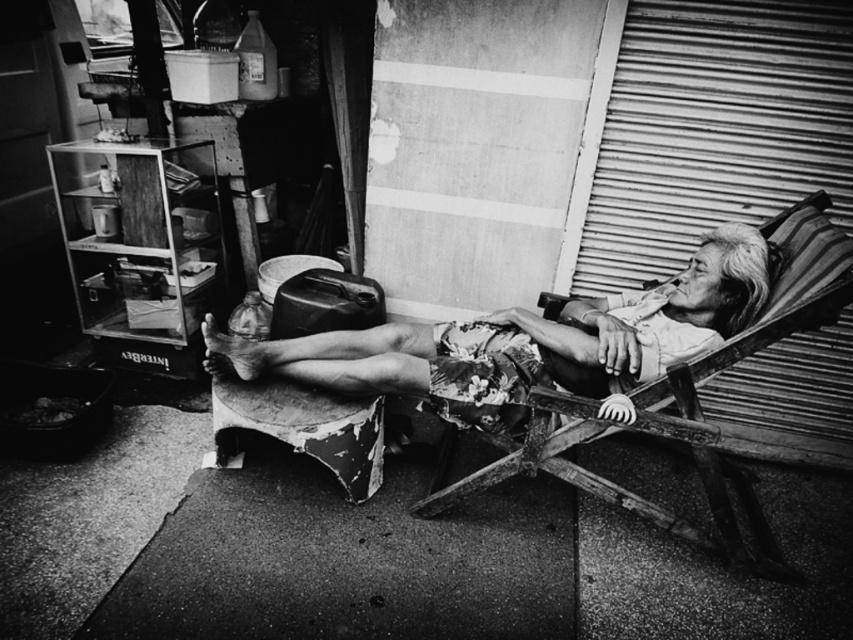
Can you confirm if floral fabric shorts at center is positioned to the left of wooden daybed at right?

Correct, you'll find floral fabric shorts at center to the left of wooden daybed at right.

Is floral fabric shorts at center taller than wooden daybed at right?

In fact, floral fabric shorts at center may be shorter than wooden daybed at right.

Where is `floral fabric shorts at center`? The image size is (853, 640). floral fabric shorts at center is located at coordinates (531, 340).

You are a GUI agent. You are given a task and a screenshot of the screen. Output one action in this format:
    pyautogui.click(x=<x>, y=<y>)
    Task: Click on the floral fabric shorts at center
    The image size is (853, 640).
    Given the screenshot: What is the action you would take?
    pyautogui.click(x=531, y=340)